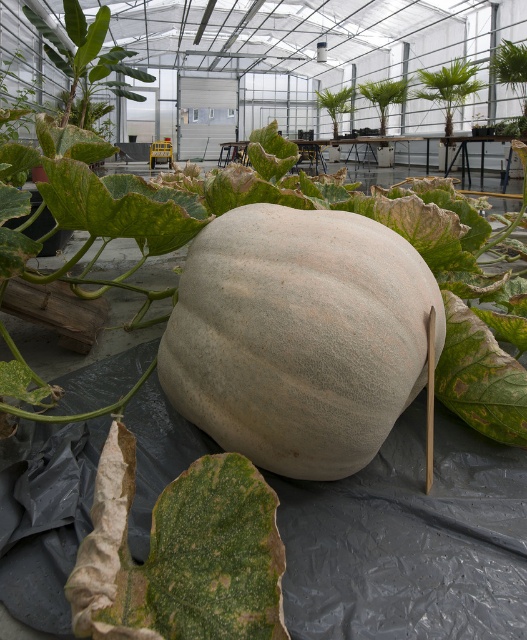
Is green leafy plant at upper center closer to the viewer compared to green leafy plant at center?

Yes, green leafy plant at upper center is in front of green leafy plant at center.

Looking at this image, who is positioned more to the left, green leafy plant at upper center or green leafy plant at center?

green leafy plant at center

Find the location of `green leafy plant at upper center`. green leafy plant at upper center is located at coordinates (448, 88).

Between point (496, 280) and point (379, 84), which one is positioned behind?

Point (379, 84)

Is point (512, 301) positioned before point (405, 90)?

Yes.

Is point (461, 202) farther from camera compared to point (384, 120)?

No, (461, 202) is closer to viewer.

The width and height of the screenshot is (527, 640). Find the location of `smooth beige pumpkin at center`. smooth beige pumpkin at center is located at coordinates (317, 209).

Describe the element at coordinates (298, 337) in the screenshot. I see `speckled beige cantaloupe at center` at that location.

Can you confirm if speckled beige cantaloupe at center is positioned below green leafy plant at upper right?

Correct, speckled beige cantaloupe at center is located below green leafy plant at upper right.

The width and height of the screenshot is (527, 640). Find the location of `speckled beige cantaloupe at center`. speckled beige cantaloupe at center is located at coordinates (298, 337).

Where is `speckled beige cantaloupe at center`? This screenshot has height=640, width=527. speckled beige cantaloupe at center is located at coordinates (298, 337).